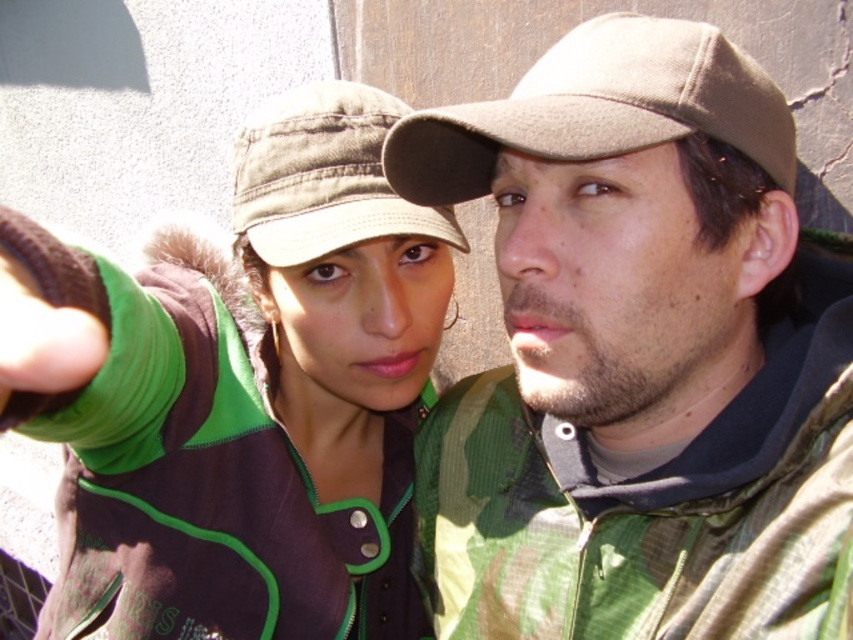
You are designing a display case for a clothing store. The display case has a shelf that can only hold items wider than 20 cm. You need to place both the green corduroy jacket at center and the beige woolen cap at upper right on the same shelf. Can both items fit on the shelf if the total width available is 50 cm?

The green corduroy jacket at center is wider than the beige woolen cap at upper right. However, since the total available width is 50 cm and the minimum required per item is 20 cm, both items can fit as long as their combined widths do not exceed 50 cm. Without exact measurements, we cannot confirm, but the jacket being wider than the cap might still allow them to fit within the limit if their total is under 50 cm.

You are taking a photo of two people standing in front of a wall. You notice the green corduroy jacket at center and the green fabric cap at center. Which object is positioned to the left?

The green corduroy jacket at center is to the left of the green fabric cap at center, so the green corduroy jacket at center is positioned to the left.

Based on the photo, you are a photographer trying to focus on the green corduroy jacket at center. Where exactly should you point your camera to capture it?

You should point your camera at point (239, 394) to capture the green corduroy jacket at center.